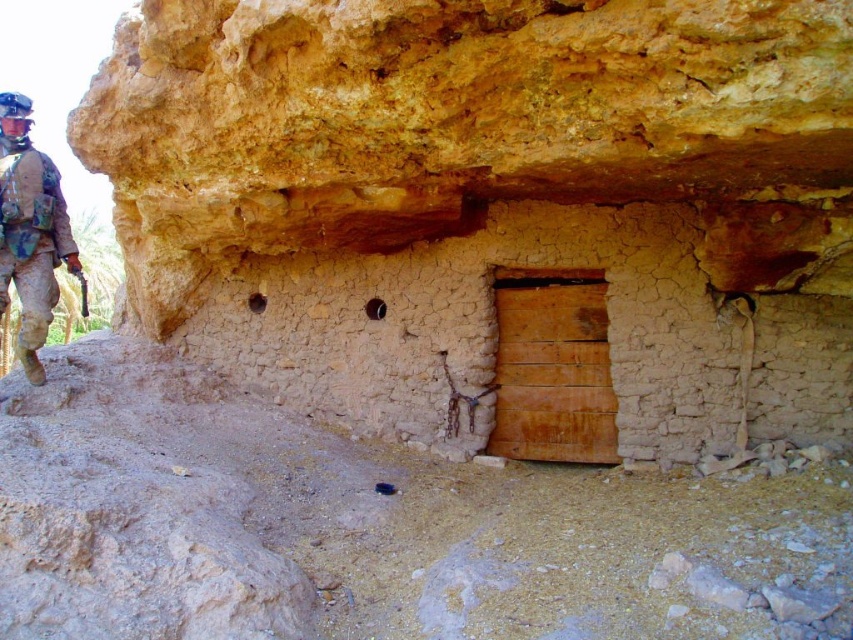
You are a traveler carrying a heavy backpack and need to enter the structure through the wooden door. You see the cracked beige wall at center and the camouflage fabric uniform at left. Can you fit through the space between them to reach the door?

The cracked beige wall at center and camouflage fabric uniform at left are 2.06 meters apart from each other. Since the traveler is carrying a heavy backpack, their total width is likely less than 2.06 meters, so they should be able to fit through the space between them to reach the door.

You are an explorer in this arid landscape and notice the cracked beige wall at center and the camouflage fabric uniform at left. Which object is positioned to the left side of the scene?

The camouflage fabric uniform at left is positioned to the left side of the scene.

You are standing in front of the structure and want to enter through the wooden door. Which object, the cracked beige wall at center or the camouflage fabric uniform at left, is closer to you as you approach the door?

The cracked beige wall at center is closer to the viewer than the camouflage fabric uniform at left, so the cracked beige wall at center would be closer as you approach the door.